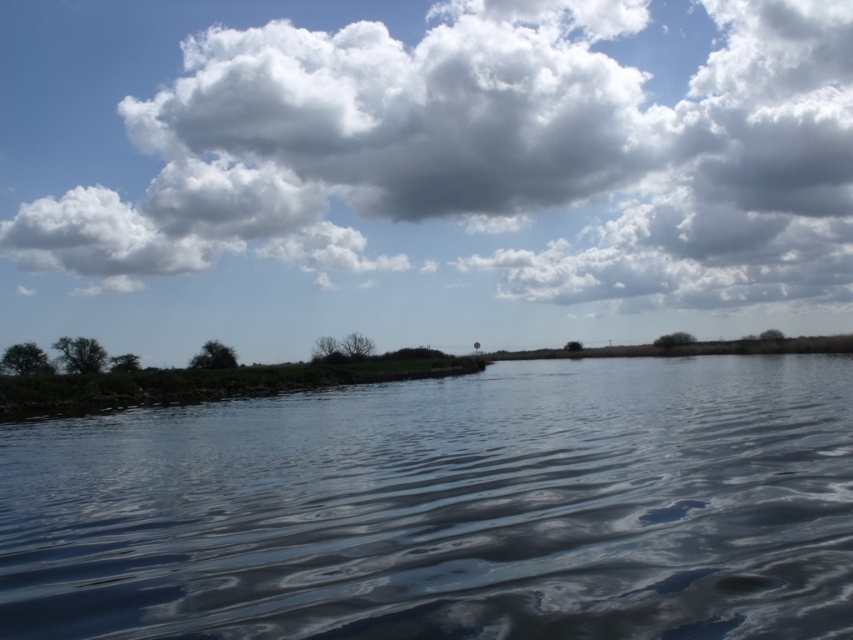
Between glossy water at center and white fluffy cloud at upper center, which one is positioned lower?

glossy water at center is below.

Does point (190, 506) come in front of point (788, 58)?

Yes, point (190, 506) is closer to viewer.

What do you see at coordinates (447, 508) in the screenshot?
I see `glossy water at center` at bounding box center [447, 508].

Identify the location of glossy water at center. The height and width of the screenshot is (640, 853). (447, 508).